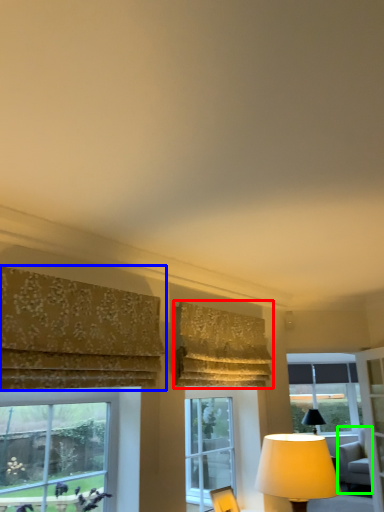
Question: Based on their relative distances, which object is farther from curtain (highlighted by a red box)? Choose from curtain (highlighted by a blue box) and swivel chair (highlighted by a green box).

Choices:
 (A) curtain
 (B) swivel chair

Answer: (B)